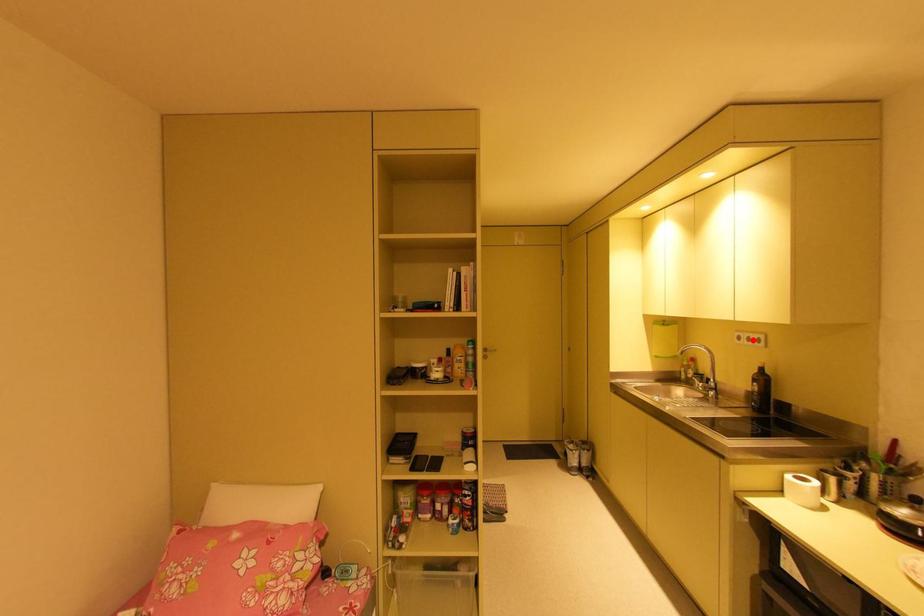
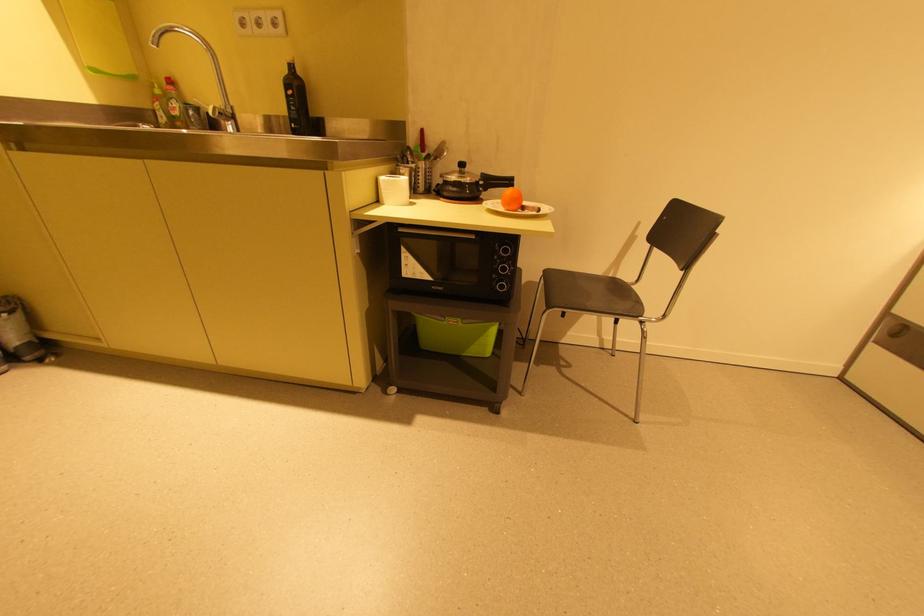
The point at the highlighted location is marked in the first image. Where is the corresponding point in the second image?

(263, 23)